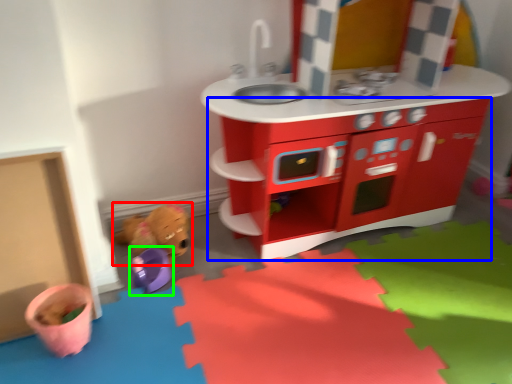
Question: Which object is positioned closest to toy (highlighted by a red box)? Select from cabinetry (highlighted by a blue box) and toy (highlighted by a green box).

Choices:
 (A) cabinetry
 (B) toy

Answer: (B)